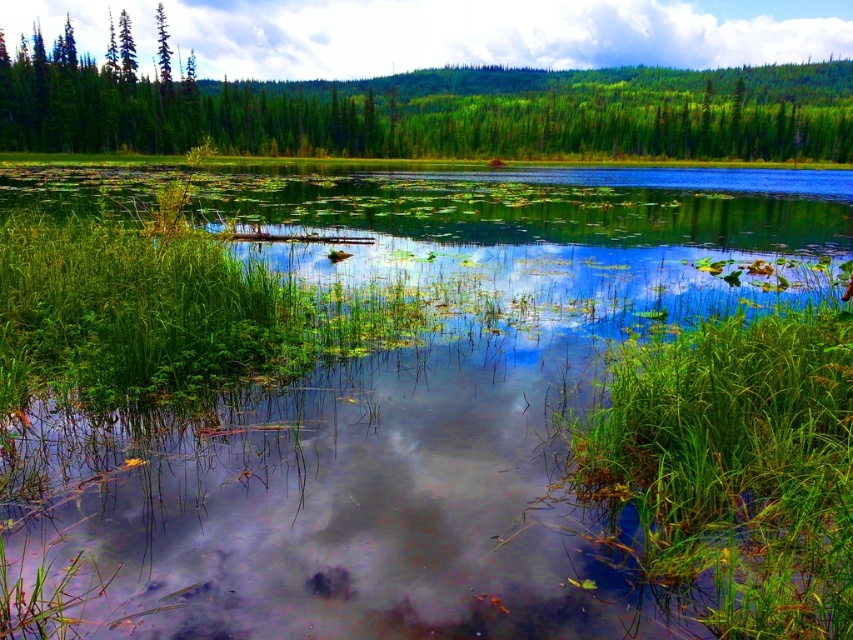
Measure the distance between white fluffy cloud at upper center and camera.

The distance of white fluffy cloud at upper center from camera is 365.90 feet.

Can you confirm if white fluffy cloud at upper center is wider than green matte tree at upper left?

Correct, the width of white fluffy cloud at upper center exceeds that of green matte tree at upper left.

Image resolution: width=853 pixels, height=640 pixels. Describe the element at coordinates (450, 33) in the screenshot. I see `white fluffy cloud at upper center` at that location.

You are a GUI agent. You are given a task and a screenshot of the screen. Output one action in this format:
    pyautogui.click(x=<x>, y=<y>)
    Task: Click on the white fluffy cloud at upper center
    
    Given the screenshot: What is the action you would take?
    pyautogui.click(x=450, y=33)

Does green matte tree at upper center have a greater height compared to green matte tree at upper left?

Yes, green matte tree at upper center is taller than green matte tree at upper left.

Who is more forward, (520, 90) or (155, 8)?

Point (155, 8)

Identify the location of green matte tree at upper center. This screenshot has width=853, height=640. (450, 97).

Who is shorter, transparent water at center or green matte tree at upper center?

With less height is transparent water at center.

Describe the element at coordinates (425, 404) in the screenshot. This screenshot has height=640, width=853. I see `transparent water at center` at that location.

Which is behind, point (627, 589) or point (65, 92)?

The point (65, 92) is more distant.

At what (x,y) coordinates should I click in order to perform the action: click on transparent water at center. Please return your answer as a coordinate pair (x, y). Image resolution: width=853 pixels, height=640 pixels. Looking at the image, I should click on (425, 404).